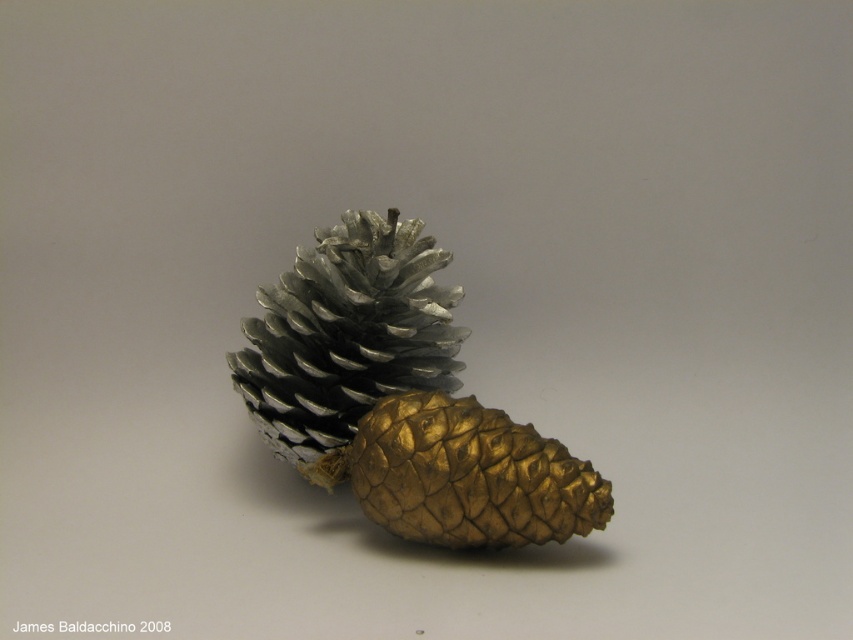
Is gold metallic pinecone at center bigger than metallic silver pine cone at center?

Yes, gold metallic pinecone at center is bigger than metallic silver pine cone at center.

Which of these two, gold metallic pinecone at center or metallic silver pine cone at center, stands shorter?

Standing shorter between the two is metallic silver pine cone at center.

What do you see at coordinates (399, 397) in the screenshot?
I see `gold metallic pinecone at center` at bounding box center [399, 397].

Locate an element on the screen. gold metallic pinecone at center is located at coordinates (399, 397).